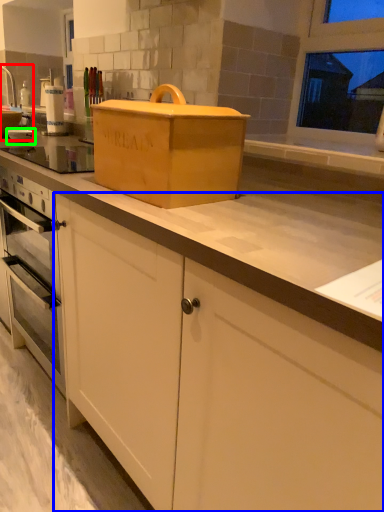
Question: Which object is the farthest from sink (highlighted by a red box)? Choose among these: cabinetry (highlighted by a blue box) or appliance (highlighted by a green box).

Choices:
 (A) cabinetry
 (B) appliance

Answer: (A)